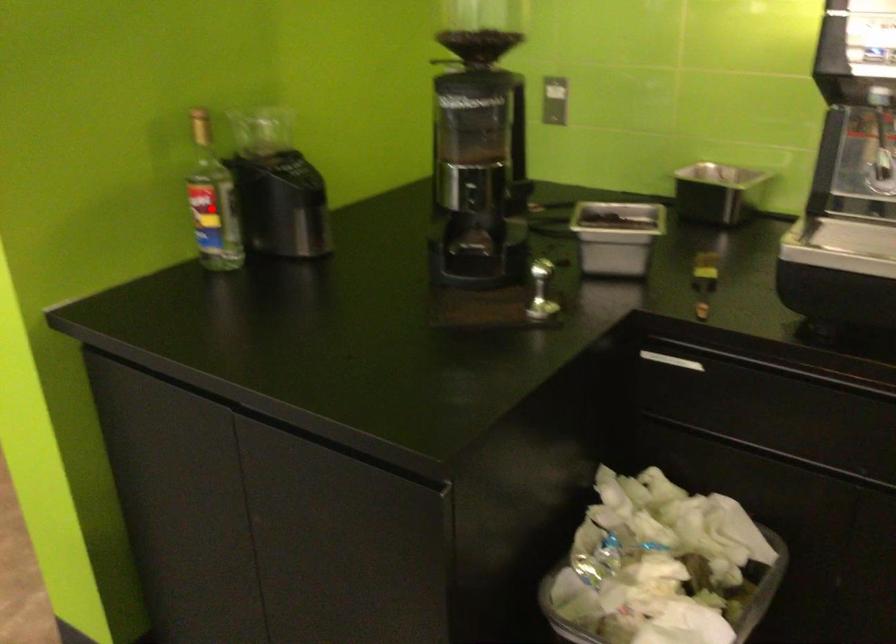
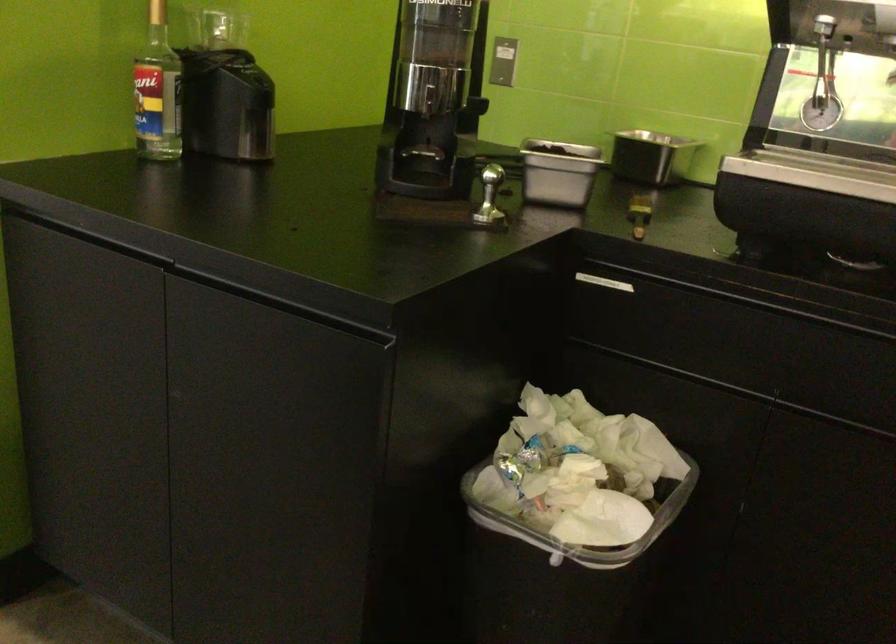
Where in the second image is the point corresponding to the highlighted location from the first image?

(158, 91)